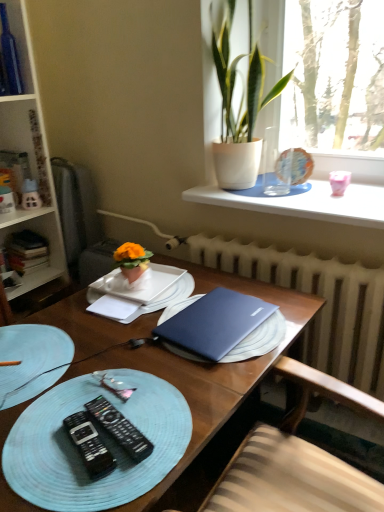
The height and width of the screenshot is (512, 384). Find the location of `space that is in front of black plastic remote control at lower left, the first remote control in the right-to-left sequence`. space that is in front of black plastic remote control at lower left, the first remote control in the right-to-left sequence is located at coordinates (103, 485).